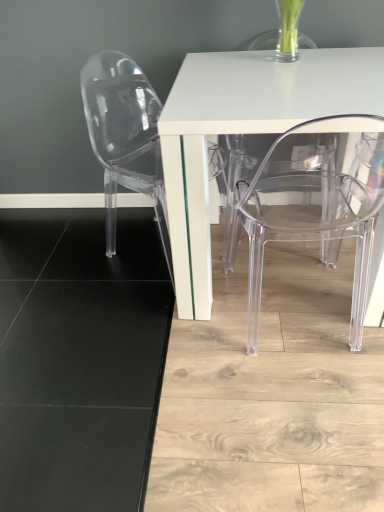
Question: Is transparent plastic chair at left, the first chair from the left, spatially inside transparent acrylic chair at lower right, which is the 2th chair in left-to-right order, or outside of it?

Choices:
 (A) outside
 (B) inside

Answer: (A)

Question: Looking at their shapes, would you say transparent plastic chair at left, arranged as the second chair when viewed from the right, is wider or thinner than transparent acrylic chair at lower right, which is the 2th chair in left-to-right order?

Choices:
 (A) thin
 (B) wide

Answer: (B)

Question: Which object is the farthest from the transparent plastic chair at left, the first chair from the left?

Choices:
 (A) transparent acrylic chair at lower right, which is the 2th chair in left-to-right order
 (B) white glossy table at center

Answer: (A)

Question: Based on their relative distances, which object is farther from the transparent plastic chair at left, arranged as the second chair when viewed from the right?

Choices:
 (A) transparent acrylic chair at lower right, which is the 2th chair in left-to-right order
 (B) white glossy table at center

Answer: (A)